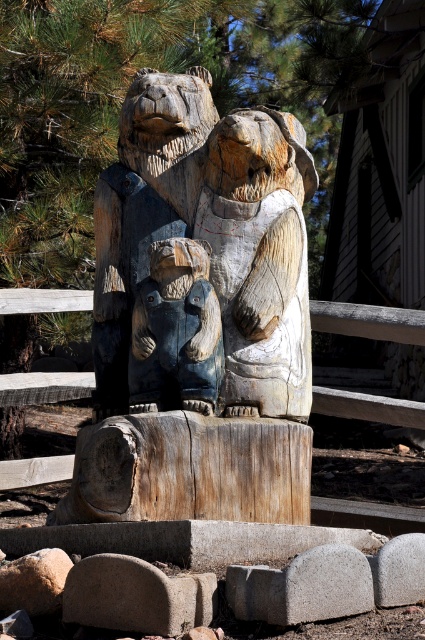
You are a visitor in the garden and want to take a photo of the carved wood bear family at center and the blue painted wood bear at center. Which bear will appear closer to you in the photo?

The carved wood bear family at center will appear closer to you in the photo because it is positioned further to the viewer than the blue painted wood bear at center.

You are a visitor at the park and want to take a photo of the carved wood bear family at center. The park has a rule that visitors must stay at least 30 feet away from all sculptures. Are you allowed to stand where you are currently positioned to take the photo?

The carved wood bear family at center are 29.89 feet apart, which is less than the required 30 feet. Therefore, you are not allowed to stand where you are currently positioned to take the photo.

You are a visitor at a garden and see the carved wood bear family at center and the blue painted wood bear at center. Which bear is positioned more to the left?

The blue painted wood bear at center is positioned more to the left than the carved wood bear family at center.